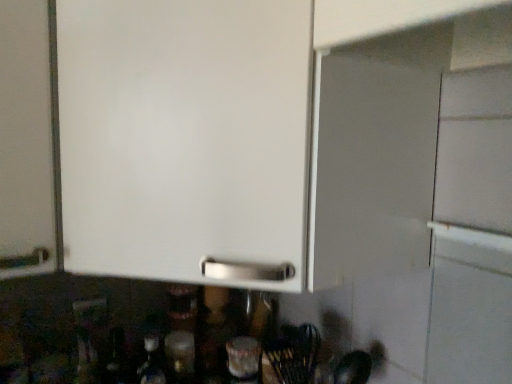
Question: From a real-world perspective, is translucent glass bottle at lower center physically below matte white outlet at lower left?

Choices:
 (A) no
 (B) yes

Answer: (B)

Question: Is translucent glass bottle at lower center positioned with its back to matte white outlet at lower left?

Choices:
 (A) no
 (B) yes

Answer: (A)

Question: Does translucent glass bottle at lower center have a greater width compared to matte white outlet at lower left?

Choices:
 (A) no
 (B) yes

Answer: (B)

Question: Can you confirm if translucent glass bottle at lower center is smaller than matte white outlet at lower left?

Choices:
 (A) no
 (B) yes

Answer: (A)

Question: Can you confirm if translucent glass bottle at lower center is taller than matte white outlet at lower left?

Choices:
 (A) no
 (B) yes

Answer: (B)

Question: Would you say translucent glass bottle at lower center is outside matte white outlet at lower left?

Choices:
 (A) yes
 (B) no

Answer: (A)

Question: Can you confirm if matte white outlet at lower left is taller than translucent glass bottle at lower center?

Choices:
 (A) no
 (B) yes

Answer: (A)

Question: Is matte white outlet at lower left at the right side of translucent glass bottle at lower center?

Choices:
 (A) no
 (B) yes

Answer: (A)

Question: Would you say matte white outlet at lower left is a long distance from translucent glass bottle at lower center?

Choices:
 (A) yes
 (B) no

Answer: (B)

Question: From the image's perspective, would you say matte white outlet at lower left is shown under translucent glass bottle at lower center?

Choices:
 (A) no
 (B) yes

Answer: (A)

Question: Is matte white outlet at lower left to the left of translucent glass bottle at lower center from the viewer's perspective?

Choices:
 (A) no
 (B) yes

Answer: (B)

Question: Are matte white outlet at lower left and translucent glass bottle at lower center beside each other?

Choices:
 (A) no
 (B) yes

Answer: (A)

Question: In terms of size, does matte white outlet at lower left appear bigger or smaller than translucent glass bottle at lower center?

Choices:
 (A) big
 (B) small

Answer: (B)